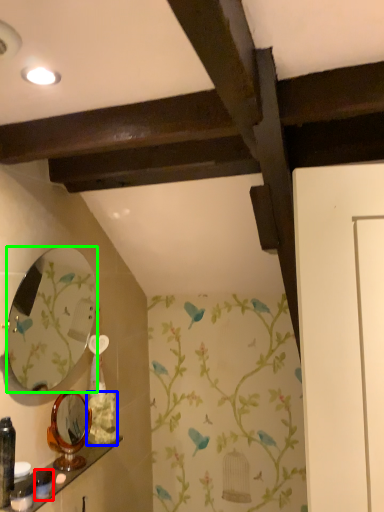
Question: Which object is positioned closest to toiletry (highlighted by a red box)? Select from flower (highlighted by a blue box) and mirror (highlighted by a green box).

Choices:
 (A) flower
 (B) mirror

Answer: (A)